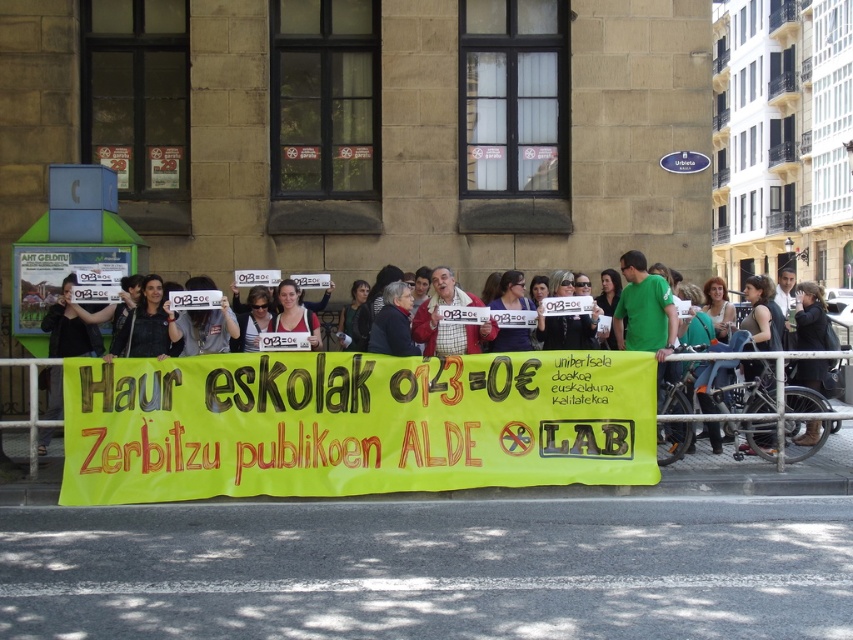
You are a photographer standing at the center of the street. You want to take a photo of the yellow fabric banner at center. According to the scene description, where should you position your camera to ensure the banner is centered in your shot?

The yellow fabric banner at center is located at the 2D coordinates point (447, 324), so positioning the camera at the center of the street facing towards those coordinates will center the banner in the shot.

What is the location of the point with coordinates [447,324] in the image?

The point with coordinates [447,324] is located on the yellow fabric banner at center.